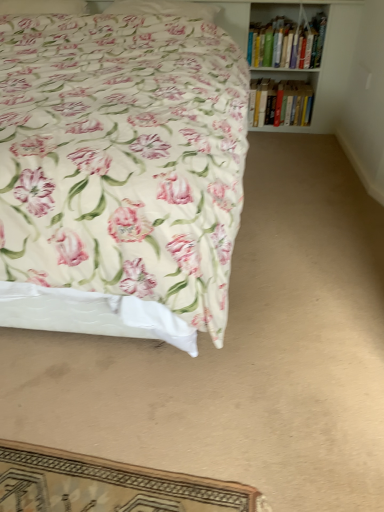
Question: From the image's perspective, is floral fabric pillow at upper left, the second pillow in the right-to-left sequence, located above hardcover books at upper right, which appears as the second book when ordered from the bottom?

Choices:
 (A) yes
 (B) no

Answer: (A)

Question: Does floral fabric pillow at upper left, the second pillow in the right-to-left sequence, come behind hardcover books at upper right, acting as the 1th book starting from the top?

Choices:
 (A) no
 (B) yes

Answer: (A)

Question: From a real-world perspective, is floral fabric pillow at upper left, the second pillow in the right-to-left sequence, positioned over hardcover books at upper right, which appears as the second book when ordered from the bottom, based on gravity?

Choices:
 (A) yes
 (B) no

Answer: (A)

Question: Considering the relative sizes of floral fabric pillow at upper left, arranged as the 1th pillow when viewed from the left, and hardcover books at upper right, acting as the 1th book starting from the top, in the image provided, is floral fabric pillow at upper left, arranged as the 1th pillow when viewed from the left, thinner than hardcover books at upper right, acting as the 1th book starting from the top,?

Choices:
 (A) yes
 (B) no

Answer: (A)

Question: Can you confirm if floral fabric pillow at upper left, the second pillow in the right-to-left sequence, is smaller than hardcover books at upper right, which appears as the second book when ordered from the bottom?

Choices:
 (A) yes
 (B) no

Answer: (A)

Question: Is hardcover books at upper right, which appears as the second book when ordered from the bottom, a part of floral fabric pillow at upper left, the second pillow in the right-to-left sequence?

Choices:
 (A) no
 (B) yes

Answer: (A)

Question: From a real-world perspective, is floral fabric pillow at upper center, the first pillow viewed from the right, over floral fabric bed at upper left?

Choices:
 (A) no
 (B) yes

Answer: (B)

Question: Is floral fabric bed at upper left located within floral fabric pillow at upper center, the first pillow viewed from the right?

Choices:
 (A) yes
 (B) no

Answer: (B)

Question: Is floral fabric pillow at upper center, the first pillow viewed from the right, not inside floral fabric bed at upper left?

Choices:
 (A) no
 (B) yes

Answer: (A)

Question: Does floral fabric pillow at upper center, the first pillow viewed from the right, lie behind floral fabric bed at upper left?

Choices:
 (A) no
 (B) yes

Answer: (B)

Question: Does floral fabric pillow at upper center, the 2th pillow from the left, come in front of floral fabric bed at upper left?

Choices:
 (A) no
 (B) yes

Answer: (A)

Question: Is there a large distance between floral fabric pillow at upper center, the first pillow viewed from the right, and floral fabric bed at upper left?

Choices:
 (A) no
 (B) yes

Answer: (B)

Question: Does hardcover books at upper right, arranged as the first book when ordered from the bottom, have a lesser height compared to hardcover books at upper right, which appears as the second book when ordered from the bottom?

Choices:
 (A) yes
 (B) no

Answer: (A)